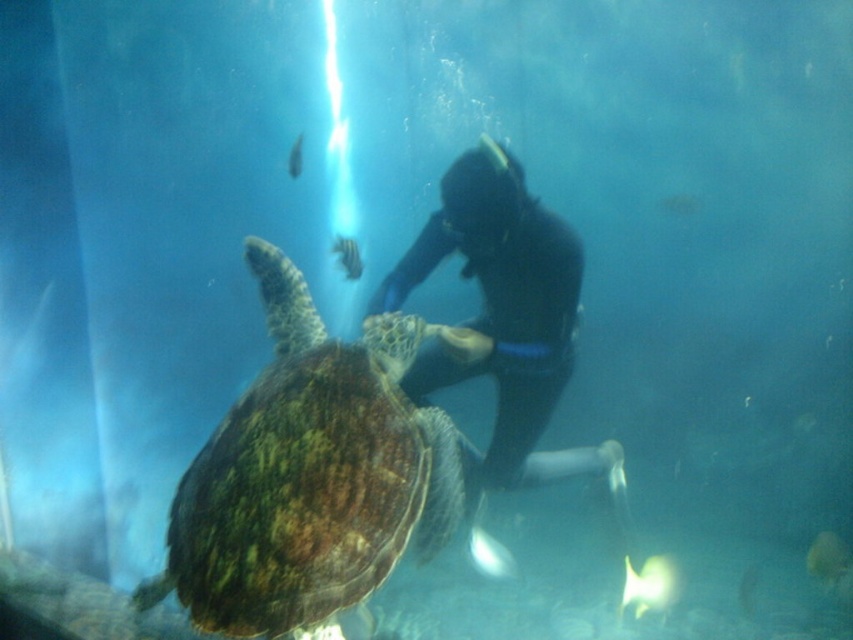
Question: Which of the following is the farthest from the observer?

Choices:
 (A) (299, 134)
 (B) (343, 236)
 (C) (292, 556)
 (D) (532, 273)

Answer: (B)

Question: Does green textured shell at center have a smaller size compared to black rubber suit at center?

Choices:
 (A) no
 (B) yes

Answer: (B)

Question: Is shiny blue fish at center below translucent greenish-blue fish at center?

Choices:
 (A) yes
 (B) no

Answer: (A)

Question: Which point appears closest to the camera in this image?

Choices:
 (A) (296, 164)
 (B) (535, 333)
 (C) (358, 552)

Answer: (C)

Question: Which of the following is the closest to the observer?

Choices:
 (A) (242, 515)
 (B) (294, 177)
 (C) (350, 250)

Answer: (A)

Question: Can you confirm if green textured shell at center is smaller than shiny blue fish at center?

Choices:
 (A) no
 (B) yes

Answer: (A)